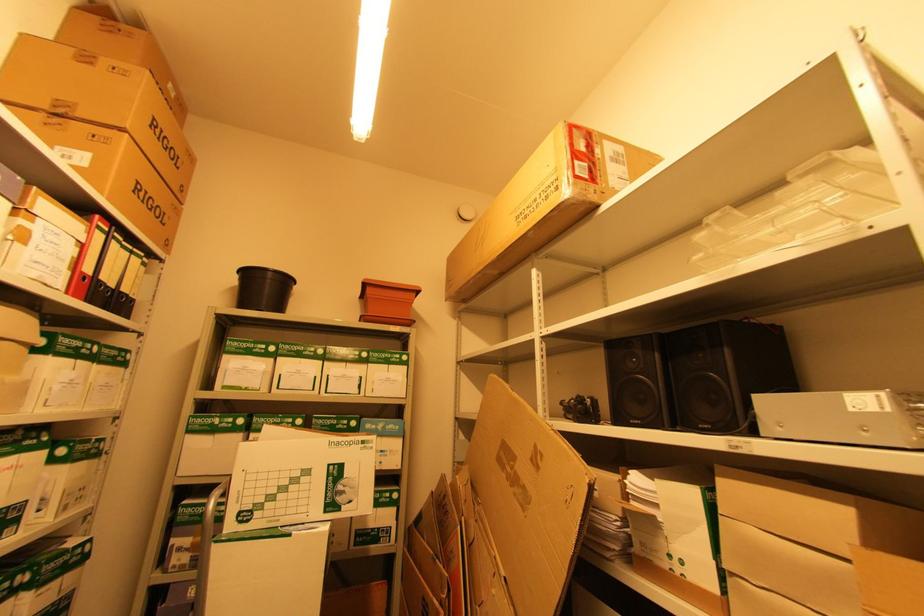
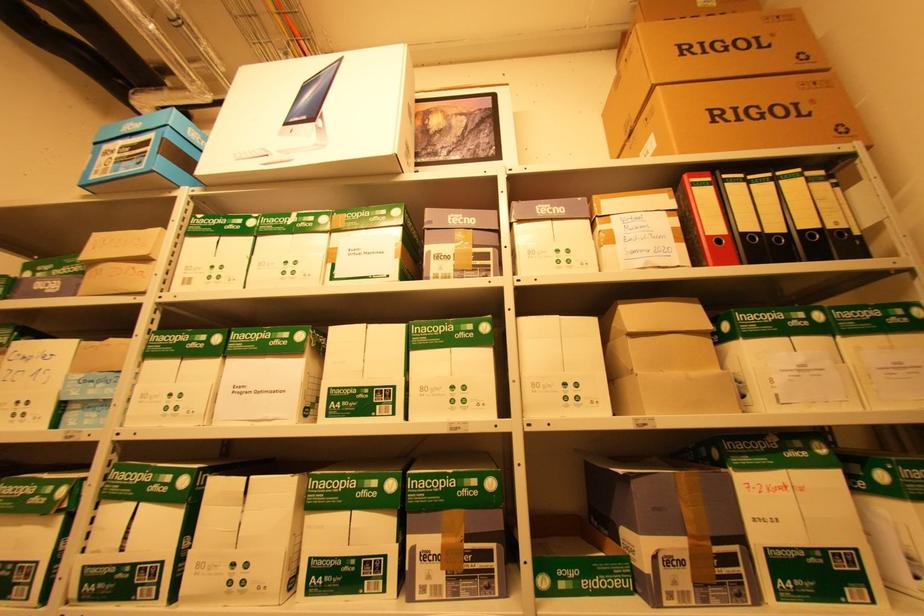
How did the camera likely rotate?

The camera rotated toward left-up.